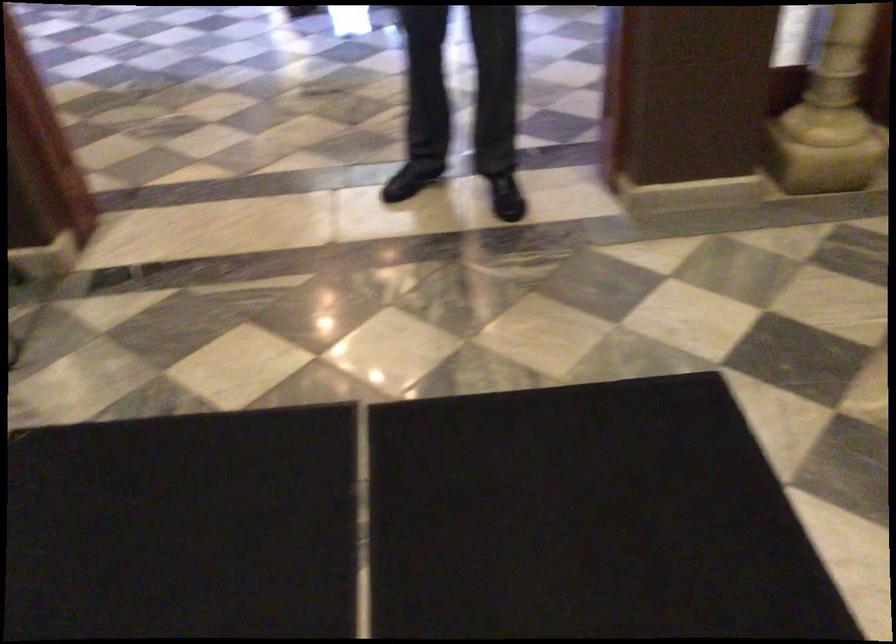
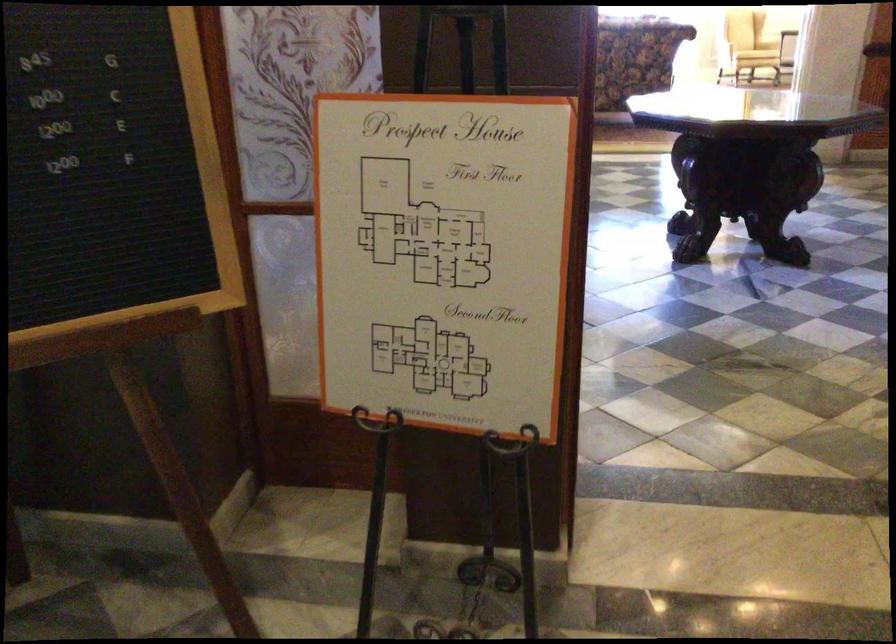
Question: Which direction would the cameraman need to move to produce the second image? Reply with the corresponding letter.

Choices:
 (A) Left
 (B) Right
 (C) Forward
 (D) Backward

Answer: (A)